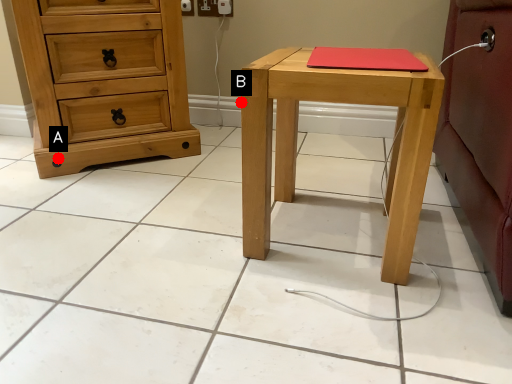
Question: Two points are circled on the image, labeled by A and B beside each circle. Which point is further to the camera?

Choices:
 (A) A is further
 (B) B is further

Answer: (B)